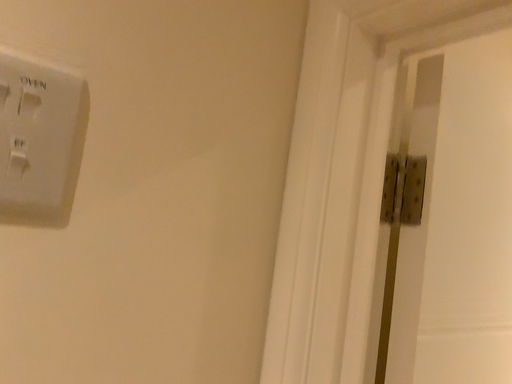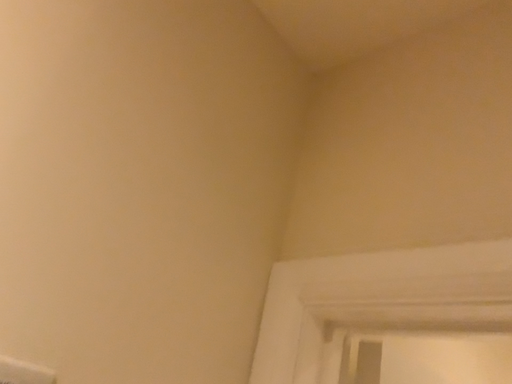
Question: How did the camera likely rotate when shooting the video?

Choices:
 (A) rotated downward
 (B) rotated upward

Answer: (B)